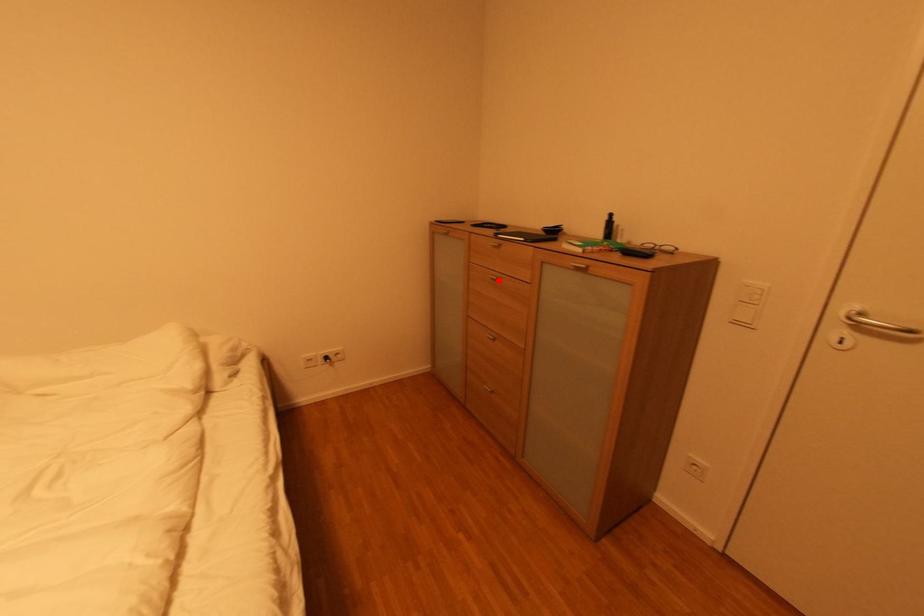
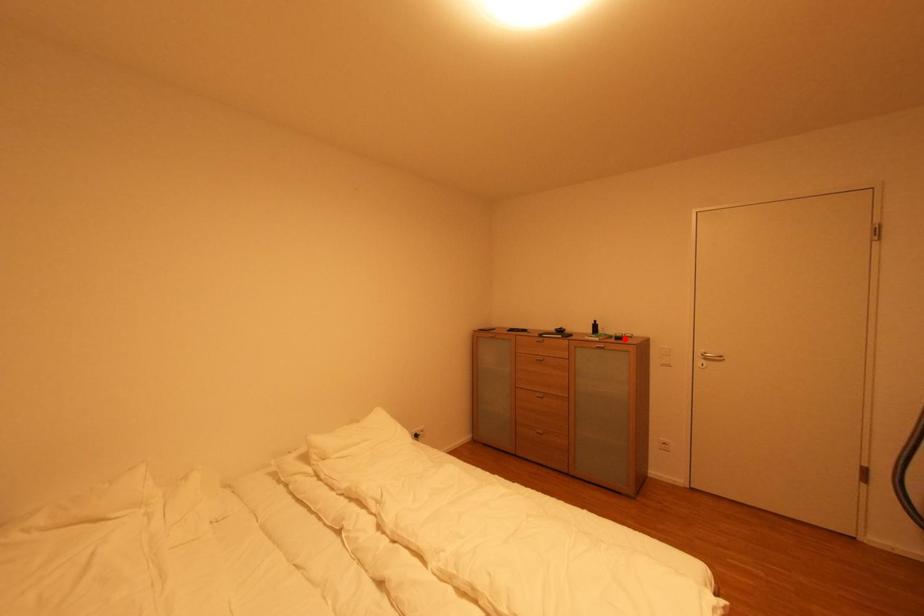
I am providing you with two images of the same scene from different viewpoints. A red point is marked on the first image and another point is marked on the second image. Do the highlighted points in image1 and image2 indicate the same real-world spot?

No